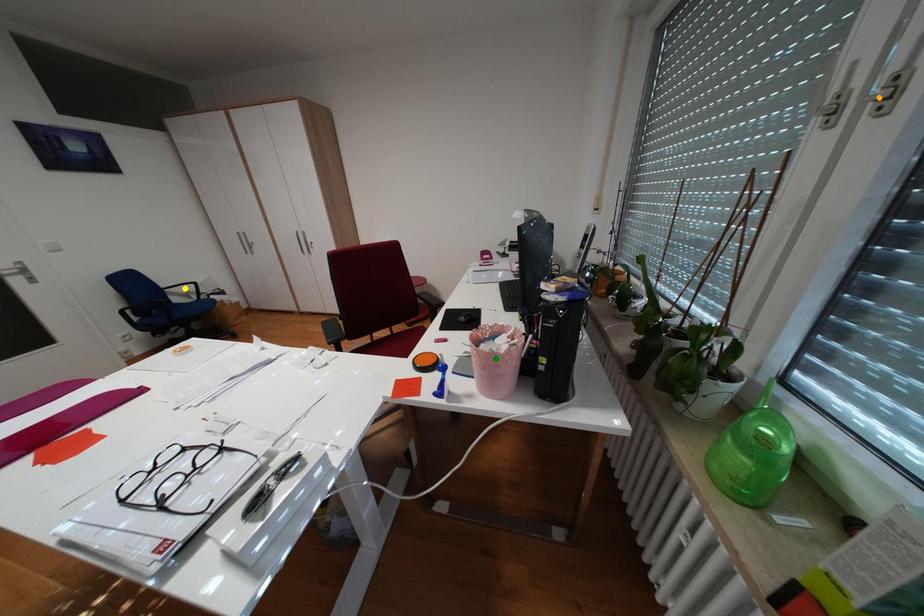
Order these from nearest to farthest:
1. orange point
2. green point
3. yellow point

1. orange point
2. green point
3. yellow point